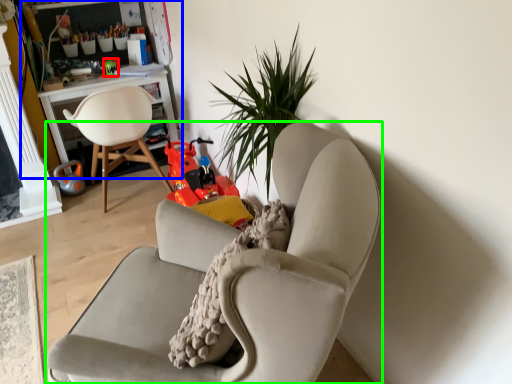
Question: Which object is positioned farthest from toy (highlighted by a red box)? Select from bookshelf (highlighted by a blue box) and chair (highlighted by a green box).

Choices:
 (A) bookshelf
 (B) chair

Answer: (B)